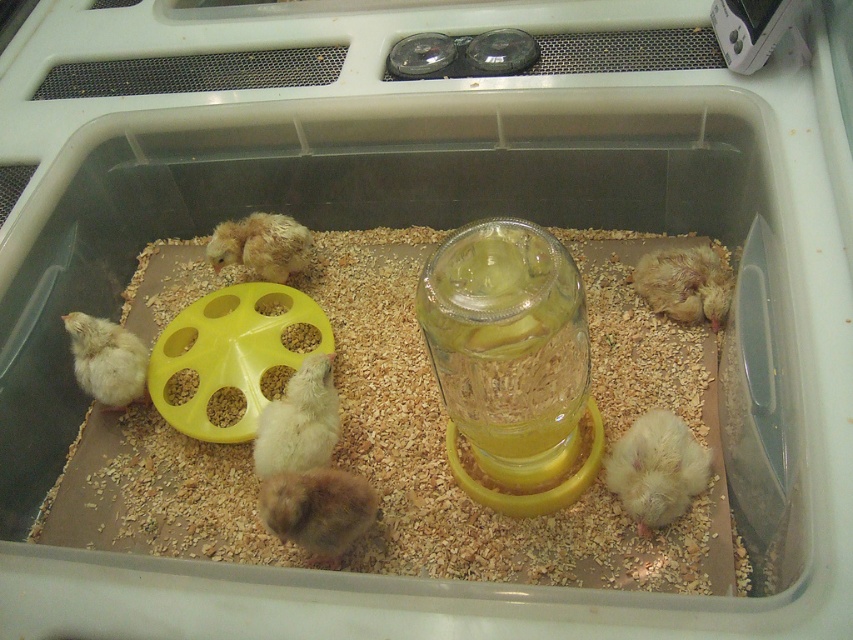
Question: Which object is closer to the camera taking this photo?

Choices:
 (A) brown fluffy chick at center
 (B) white fluffy hamster at lower right
 (C) white fluffy chick at center

Answer: (A)

Question: Which object is positioned farthest from the soft yellow chick at center?

Choices:
 (A) white fluffy hamster at lower right
 (B) white fluffy chick at left
 (C) light brown fluffy chick at right
 (D) white fluffy chick at center

Answer: (A)

Question: Does white fluffy chick at center have a larger size compared to white fluffy chick at left?

Choices:
 (A) no
 (B) yes

Answer: (A)

Question: Which point is closer to the camera taking this photo?

Choices:
 (A) (688, 256)
 (B) (277, 220)

Answer: (A)

Question: Observing the image, what is the correct spatial positioning of light brown fluffy chick at right in reference to soft yellow chick at center?

Choices:
 (A) left
 (B) right

Answer: (B)

Question: Can you confirm if white fluffy chick at center is positioned to the left of light brown fluffy chick at right?

Choices:
 (A) yes
 (B) no

Answer: (A)